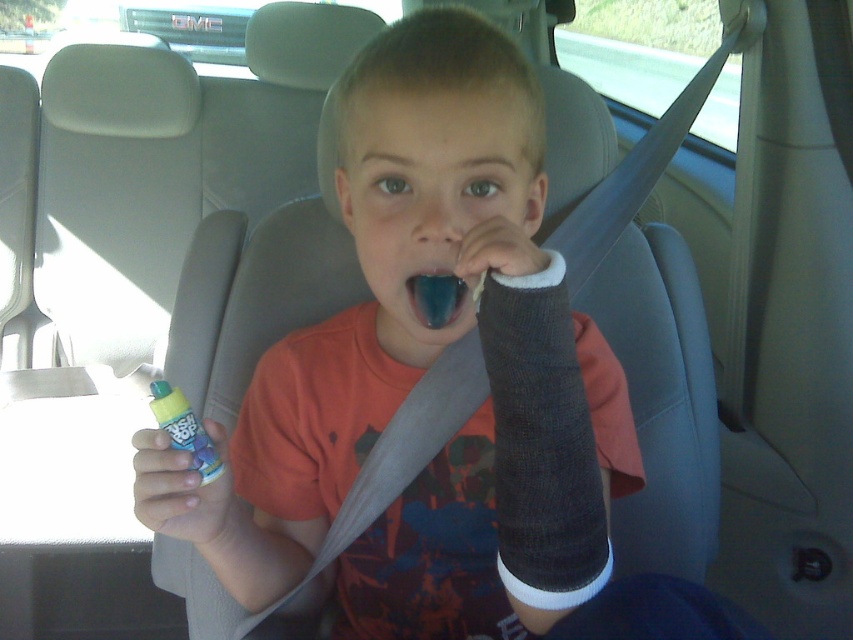
Question: Which point is farther from the camera taking this photo?

Choices:
 (A) (434, 298)
 (B) (171, 410)

Answer: (A)

Question: Does translucent plastic bottle at lower left appear on the left side of teeth enamel at center?

Choices:
 (A) no
 (B) yes

Answer: (B)

Question: Does translucent plastic bottle at lower left have a greater width compared to teeth enamel at center?

Choices:
 (A) yes
 (B) no

Answer: (A)

Question: In this image, where is translucent plastic bottle at lower left located relative to teeth enamel at center?

Choices:
 (A) below
 (B) above

Answer: (A)

Question: Which object is closer to the camera taking this photo?

Choices:
 (A) teeth enamel at center
 (B) translucent plastic bottle at lower left

Answer: (B)